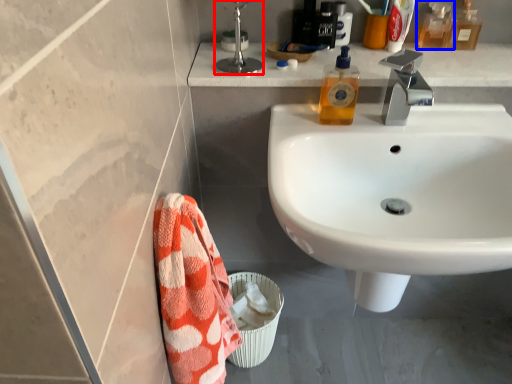
Question: Which of the following is the closest to the observer, plumbing fixture (highlighted by a red box) or mouthwash (highlighted by a blue box)?

Choices:
 (A) plumbing fixture
 (B) mouthwash

Answer: (A)